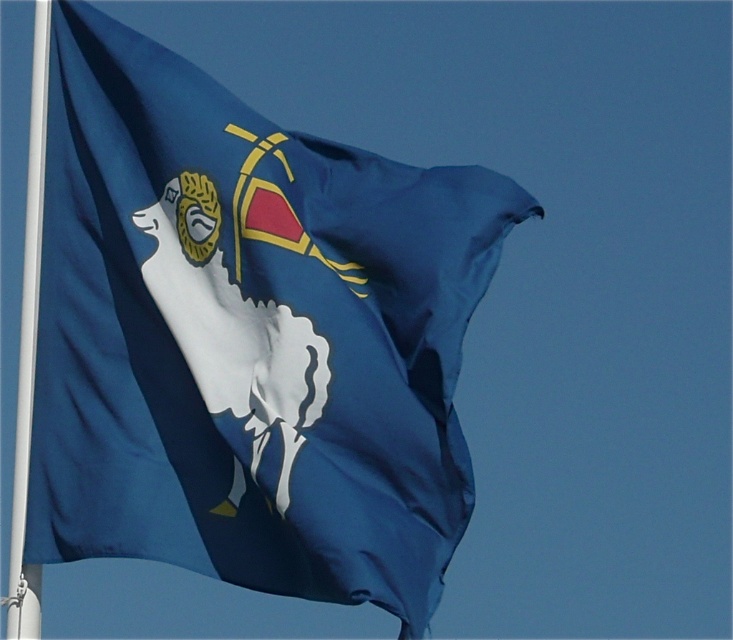
Between blue silk flag at center and white plastic pole at left, which one is positioned lower?

Positioned lower is blue silk flag at center.

Is blue silk flag at center to the right of white plastic pole at left from the viewer's perspective?

Yes, blue silk flag at center is to the right of white plastic pole at left.

Is point (136, 228) closer to camera compared to point (18, 460)?

No, (136, 228) is further to viewer.

The height and width of the screenshot is (640, 733). In order to click on blue silk flag at center in this screenshot , I will do `click(246, 337)`.